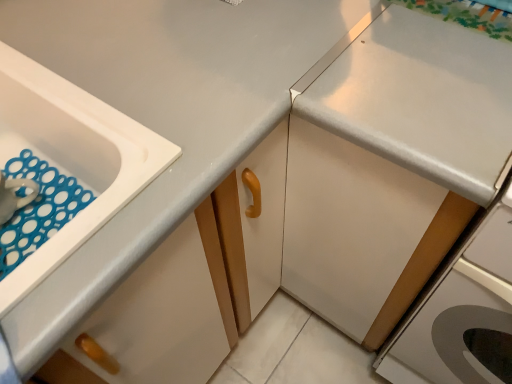
Question: From their relative heights in the image, would you say white glossy drawer at lower left is taller or shorter than white glossy countertop at upper right?

Choices:
 (A) tall
 (B) short

Answer: (B)

Question: Looking at their shapes, would you say white glossy drawer at lower left is wider or thinner than white glossy countertop at upper right?

Choices:
 (A) thin
 (B) wide

Answer: (A)

Question: Which object is the farthest from the white glossy drawer at lower left?

Choices:
 (A) white plastic sink at left
 (B) white glossy cabinet at right
 (C) white glossy countertop at upper right

Answer: (B)

Question: Which is nearer to the white glossy cabinet at right?

Choices:
 (A) white glossy drawer at lower left
 (B) white glossy countertop at upper right
 (C) white plastic sink at left

Answer: (B)